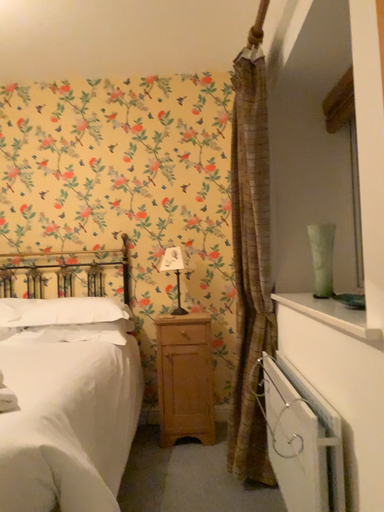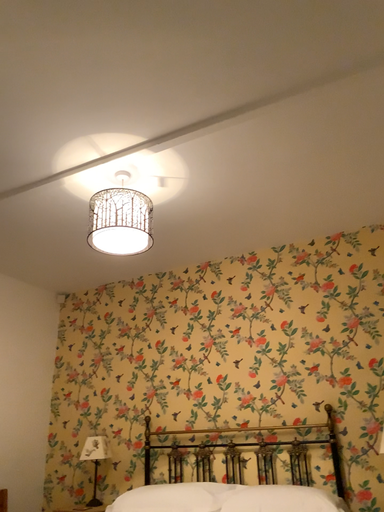
Question: Which way did the camera rotate in the video?

Choices:
 (A) rotated upward
 (B) rotated downward

Answer: (A)